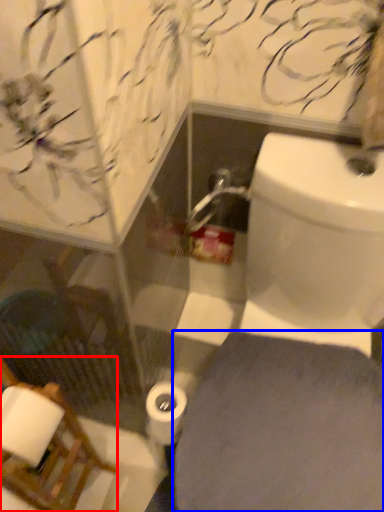
Question: Which object is closer to the camera taking this photo, chair (highlighted by a red box) or porcelain (highlighted by a blue box)?

Choices:
 (A) chair
 (B) porcelain

Answer: (A)